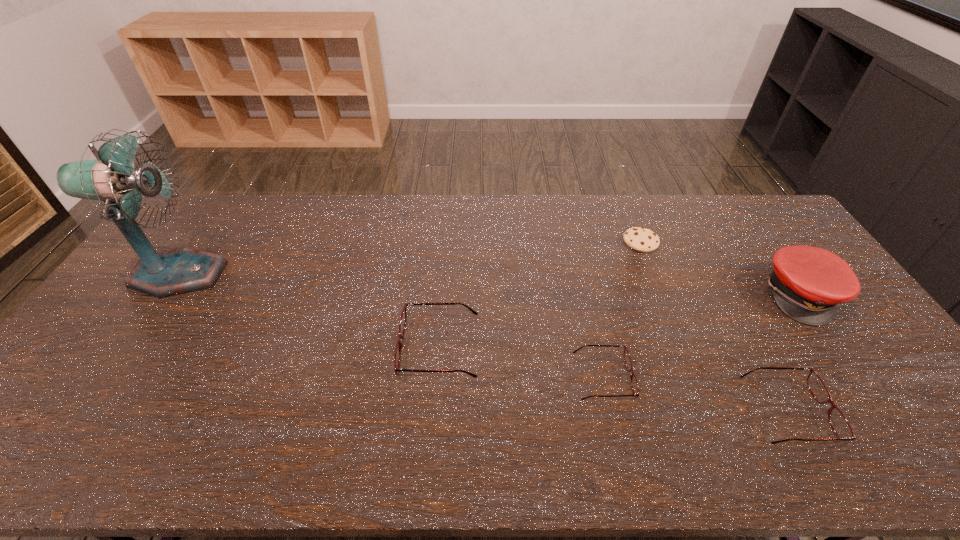
The width and height of the screenshot is (960, 540). I want to click on spectacles that can be found as the second closest to the fan, so click(x=634, y=383).

Locate an element on the screen. free space that satisfies the following two spatial constraints: 1. on the front of the cap with an emblem; 2. on the lenses of the fourth shortest object is located at coordinates (838, 348).